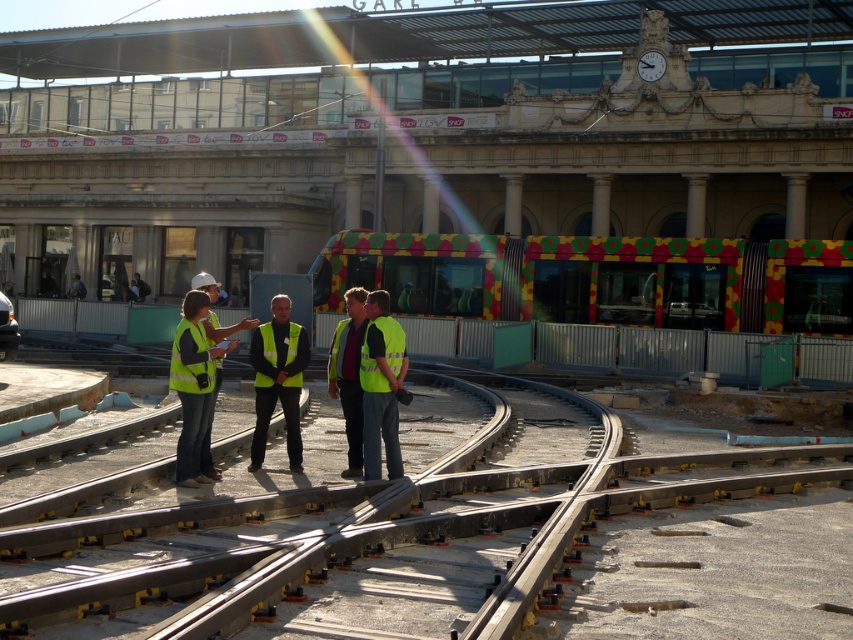
You are standing at the railway station and want to determine the relative positions of two points marked in the image. Which point, point 1 at coordinates (186, 358) or point 2 at coordinates (386, 352), is closer to you?

Point 1 at coordinates (186, 358) is closer to the viewer than point 2 at coordinates (386, 352).

You are a construction inspector at the railway station. You notice two yellow reflective vests at the center of the tracks. Which one is closer to you, the yellow reflective vest at center or the bright yellow reflective safety vest at center?

The yellow reflective vest at center is closer to you since it is in front of the bright yellow reflective safety vest at center.

You are a construction worker at the railway station. You need to locate your yellow reflective vest at center. Where would you look?

The yellow reflective vest at center is located at point (381, 387).